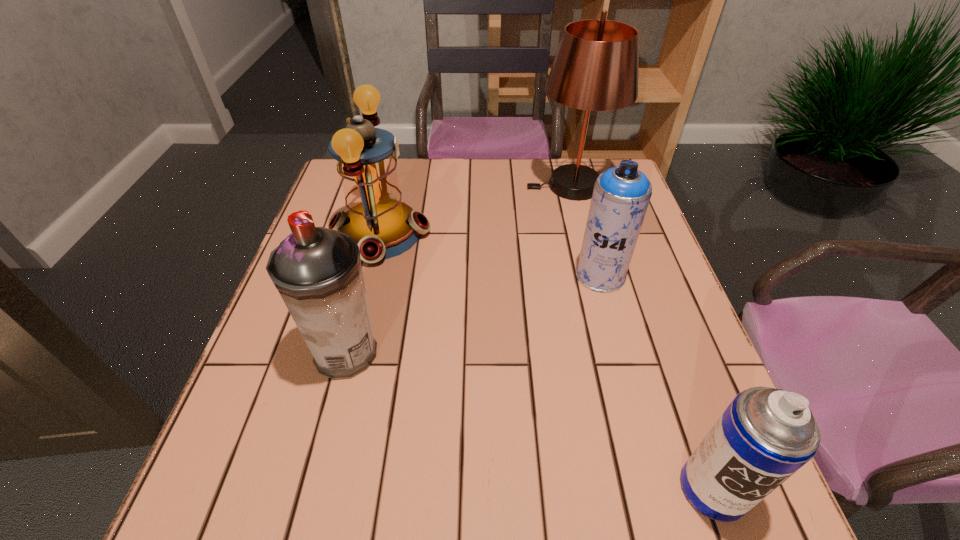
The height and width of the screenshot is (540, 960). Identify the location of empty space that is in between the second farthest aerosol can and the farthest aerosol can. (473, 314).

Identify the location of free area in between the farthest aerosol can and the fourth farthest object. This screenshot has width=960, height=540. (473, 314).

Identify the location of free space that is in between the nearest aerosol can and the tallest object. (641, 337).

The width and height of the screenshot is (960, 540). I want to click on vacant space in between the lantern and the nearest object, so click(x=546, y=361).

The width and height of the screenshot is (960, 540). I want to click on the second closest object to the farthest aerosol can, so click(383, 227).

Locate which object is the third closest to the lantern. Please provide its 2D coordinates. Your answer should be formatted as a tuple, i.e. [(x, y)], where the tuple contains the x and y coordinates of a point satisfying the conditions above.

[(621, 195)]

Identify which aerosol can is the closest to the nearest object. Please provide its 2D coordinates. Your answer should be formatted as a tuple, i.e. [(x, y)], where the tuple contains the x and y coordinates of a point satisfying the conditions above.

[(621, 195)]

Locate an element on the screen. aerosol can that stands as the closest to the lantern is located at coordinates (317, 271).

This screenshot has width=960, height=540. Identify the location of free space that satisfies the following two spatial constraints: 1. on the back side of the farthest aerosol can; 2. on the left side of the second farthest aerosol can. (367, 275).

You are a GUI agent. You are given a task and a screenshot of the screen. Output one action in this format:
    pyautogui.click(x=<x>, y=<y>)
    Task: Click on the vacant position in the image that satisfies the following two spatial constraints: 1. on the front-facing side of the lampshade; 2. on the right side of the farthest aerosol can
    
    Given the screenshot: What is the action you would take?
    pyautogui.click(x=593, y=275)